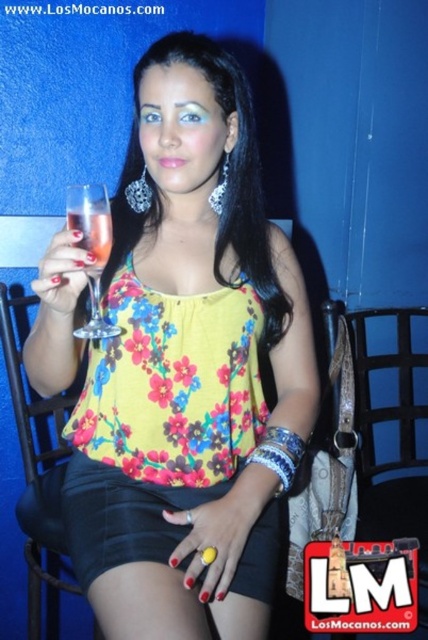
Is floral print blouse at center bigger than black leather chair at right?

Correct, floral print blouse at center is larger in size than black leather chair at right.

Does floral print blouse at center appear under black leather chair at right?

Actually, floral print blouse at center is above black leather chair at right.

Does point (166, 122) come closer to viewer compared to point (360, 353)?

Yes, it is in front of point (360, 353).

Where is `floral print blouse at center`? The height and width of the screenshot is (640, 428). floral print blouse at center is located at coordinates click(190, 369).

Can you confirm if black leather chair at left is wider than black leather chair at right?

Yes, black leather chair at left is wider than black leather chair at right.

Is black leather chair at left thinner than black leather chair at right?

No, black leather chair at left is not thinner than black leather chair at right.

Which is in front, point (67, 403) or point (388, 417)?

Point (67, 403) is more forward.

Locate an element on the screen. The height and width of the screenshot is (640, 428). black leather chair at left is located at coordinates (36, 472).

Which is in front, point (410, 442) or point (95, 189)?

Point (95, 189) is more forward.

Is black leather chair at right to the left of clear glass wine glass at left from the viewer's perspective?

Incorrect, black leather chair at right is not on the left side of clear glass wine glass at left.

The image size is (428, 640). In order to click on black leather chair at right in this screenshot , I will do `click(398, 388)`.